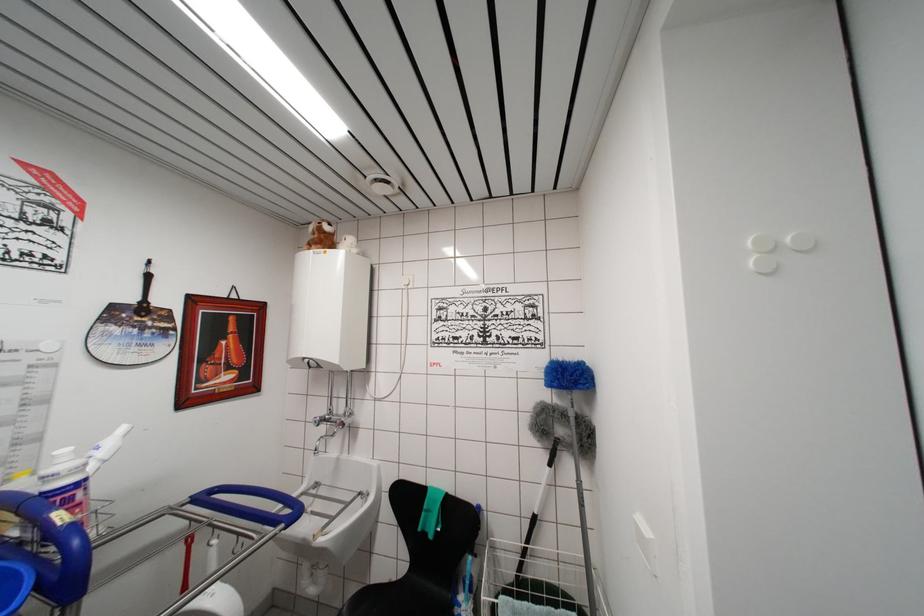
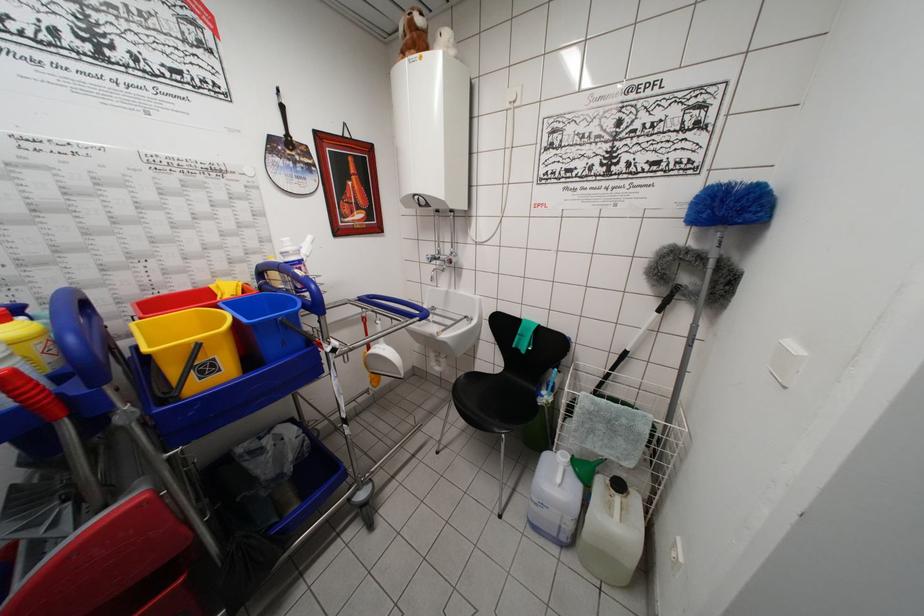
Find the pixel in the second image that matches [563,374] in the first image.

(723, 199)